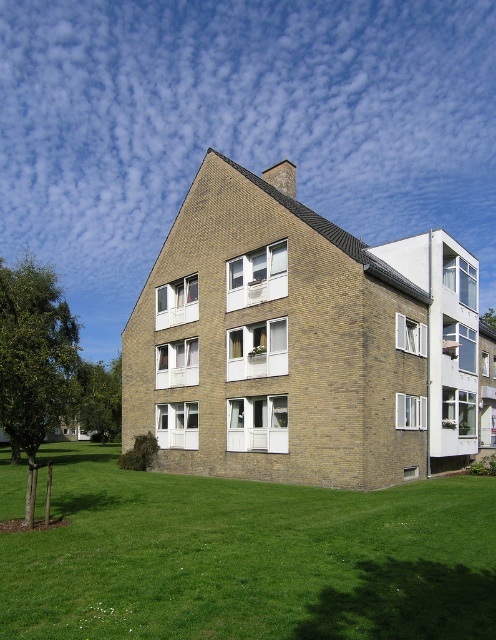
You are standing at the base of the green leafy tree at lower left and want to walk towards the green grass at lower center. Which direction should you head?

The green grass at lower center is located above the green leafy tree at lower left, so you should head upwards to reach it.